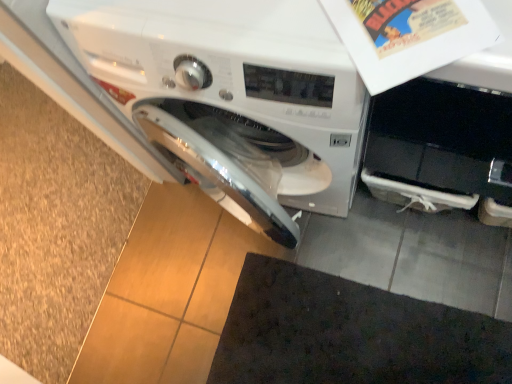
At what (x,y) coordinates should I click in order to perform the action: click on white glossy washing machine at center. Please return your answer as a coordinate pair (x, y). The width and height of the screenshot is (512, 384). Looking at the image, I should click on [233, 96].

The height and width of the screenshot is (384, 512). What do you see at coordinates (233, 96) in the screenshot? I see `white glossy washing machine at center` at bounding box center [233, 96].

The height and width of the screenshot is (384, 512). I want to click on dark fabric doormat at lower center, so click(x=350, y=334).

This screenshot has width=512, height=384. Describe the element at coordinates (350, 334) in the screenshot. I see `dark fabric doormat at lower center` at that location.

Locate an element on the screen. The width and height of the screenshot is (512, 384). white glossy washing machine at center is located at coordinates (233, 96).

Can you confirm if dark fabric doormat at lower center is positioned to the left of white glossy washing machine at center?

No.

Which object is further away from the camera taking this photo, dark fabric doormat at lower center or white glossy washing machine at center?

Positioned behind is dark fabric doormat at lower center.

Which is nearer, [417,333] or [238,155]?

The point [238,155] is in front.

From the image's perspective, which object appears higher, dark fabric doormat at lower center or white glossy washing machine at center?

white glossy washing machine at center, from the image's perspective.

From a real-world perspective, which is physically below, dark fabric doormat at lower center or white glossy washing machine at center?

In real-world perspective, dark fabric doormat at lower center is lower.

Which object is thinner, dark fabric doormat at lower center or white glossy washing machine at center?

Thinner between the two is white glossy washing machine at center.

Does dark fabric doormat at lower center have a greater height compared to white glossy washing machine at center?

Incorrect, the height of dark fabric doormat at lower center is not larger of that of white glossy washing machine at center.

Who is bigger, dark fabric doormat at lower center or white glossy washing machine at center?

white glossy washing machine at center.

Is white glossy washing machine at center a part of dark fabric doormat at lower center?

No, white glossy washing machine at center is located outside of dark fabric doormat at lower center.

Are dark fabric doormat at lower center and white glossy washing machine at center far apart?

dark fabric doormat at lower center is near white glossy washing machine at center, not far away.

Is dark fabric doormat at lower center facing away from white glossy washing machine at center?

No, white glossy washing machine at center is not at the back of dark fabric doormat at lower center.

What's the angular difference between dark fabric doormat at lower center and white glossy washing machine at center's facing directions?

They differ by 89.3 degrees in their facing directions.

At what (x,y) coordinates should I click in order to perform the action: click on washing machine above the dark fabric doormat at lower center (from a real-world perspective). Please return your answer as a coordinate pair (x, y). Looking at the image, I should click on (233, 96).

Does white glossy washing machine at center appear on the left side of dark fabric doormat at lower center?

Correct, you'll find white glossy washing machine at center to the left of dark fabric doormat at lower center.

Which object is closer to the camera taking this photo, white glossy washing machine at center or dark fabric doormat at lower center?

white glossy washing machine at center is more forward.

Is point (160, 79) closer or farther from the camera than point (455, 379)?

Point (160, 79) is closer to the camera than point (455, 379).

From the image's perspective, is white glossy washing machine at center on dark fabric doormat at lower center?

Correct, white glossy washing machine at center appears higher than dark fabric doormat at lower center in the image.

From a real-world perspective, between white glossy washing machine at center and dark fabric doormat at lower center, who is vertically lower?

dark fabric doormat at lower center, from a real-world perspective.

Can you confirm if white glossy washing machine at center is thinner than dark fabric doormat at lower center?

Yes.

Is white glossy washing machine at center taller or shorter than dark fabric doormat at lower center?

In the image, white glossy washing machine at center appears to be taller than dark fabric doormat at lower center.

Does white glossy washing machine at center have a larger size compared to dark fabric doormat at lower center?

Yes.

Is white glossy washing machine at center outside of dark fabric doormat at lower center?

Indeed, white glossy washing machine at center is completely outside dark fabric doormat at lower center.

Looking at this image, are white glossy washing machine at center and dark fabric doormat at lower center far apart?

No, there isn't a large distance between white glossy washing machine at center and dark fabric doormat at lower center.

Could you tell me if white glossy washing machine at center is turned towards dark fabric doormat at lower center?

No, white glossy washing machine at center is not oriented towards dark fabric doormat at lower center.

Can you tell me how much white glossy washing machine at center and dark fabric doormat at lower center differ in facing direction?

They differ by 89.3 degrees in their facing directions.

Where is `washing machine that is in front of the dark fabric doormat at lower center`? washing machine that is in front of the dark fabric doormat at lower center is located at coordinates (233, 96).

The height and width of the screenshot is (384, 512). What are the coordinates of `washing machine in front of the dark fabric doormat at lower center` in the screenshot? It's located at (233, 96).

Find the location of a particular element. washing machine above the dark fabric doormat at lower center (from a real-world perspective) is located at coordinates (233, 96).